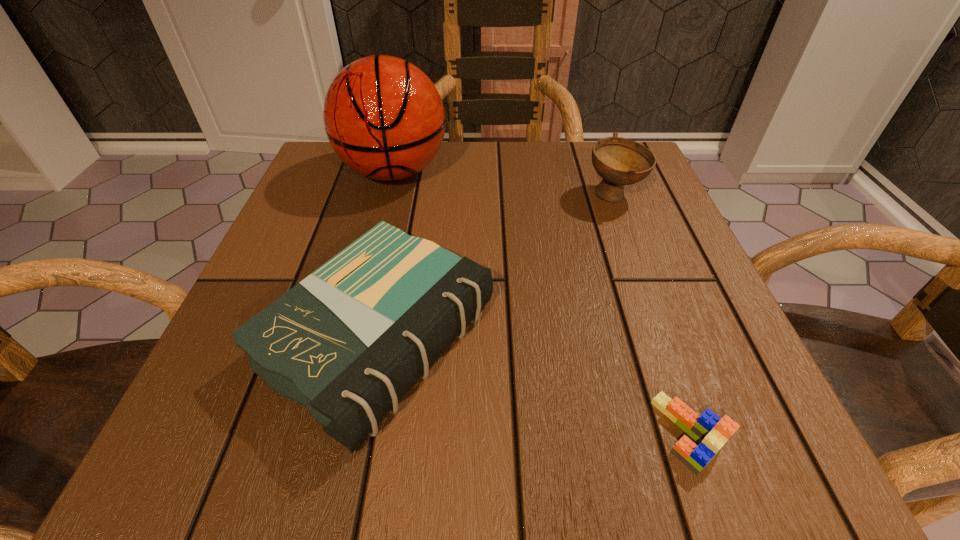
This screenshot has height=540, width=960. Identify the location of paperback book that is at the near edge. (348, 342).

I want to click on Lego that is at the near edge, so click(711, 432).

This screenshot has width=960, height=540. I want to click on basketball present at the left edge, so click(383, 116).

Where is `paperback book present at the left edge`? paperback book present at the left edge is located at coordinates (348, 342).

Identify the location of soup bowl present at the right edge. The height and width of the screenshot is (540, 960). (619, 161).

This screenshot has height=540, width=960. In order to click on Lego at the right edge in this screenshot , I will do `click(711, 432)`.

Locate an element on the screen. object at the far left corner is located at coordinates (383, 116).

The height and width of the screenshot is (540, 960). Find the location of `object that is positioned at the near left corner`. object that is positioned at the near left corner is located at coordinates (348, 342).

Locate an element on the screen. The image size is (960, 540). object that is at the far right corner is located at coordinates (619, 161).

Identify the location of object that is at the near right corner. This screenshot has height=540, width=960. (711, 432).